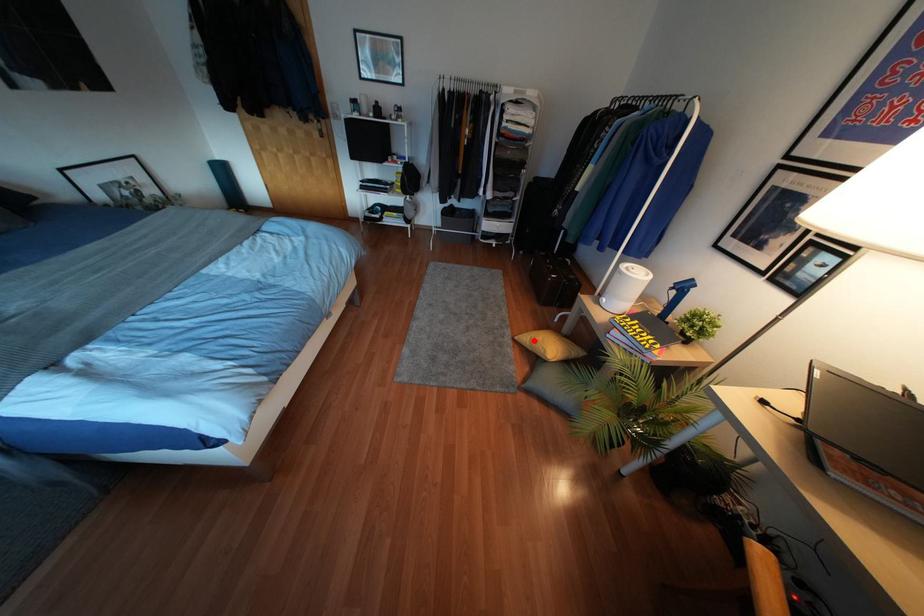
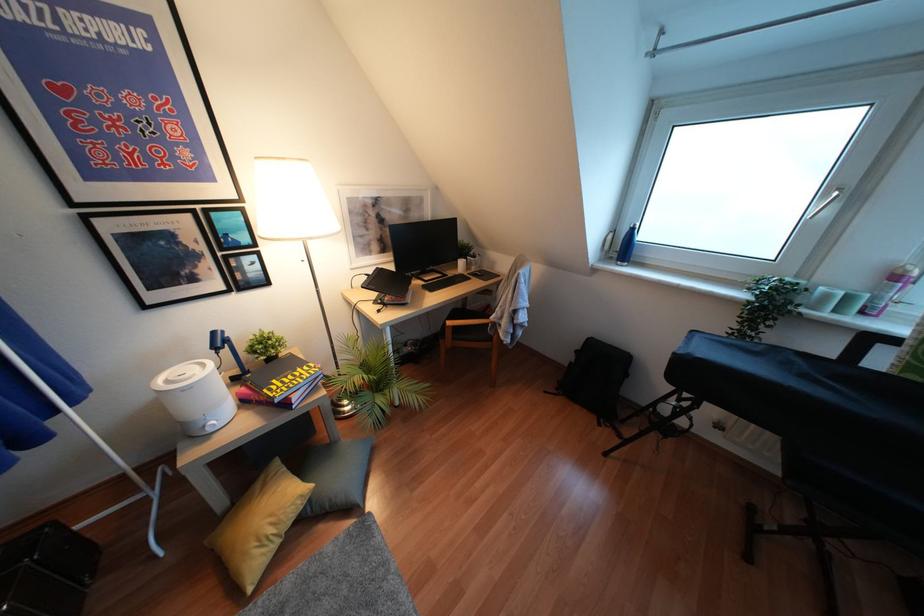
Question: I am providing you with two images of the same scene from different viewpoints. In image1, a red point is highlighted. Considering the same 3D point in image2, which of the following is correct?

Choices:
 (A) It is closer
 (B) It is farther

Answer: (B)